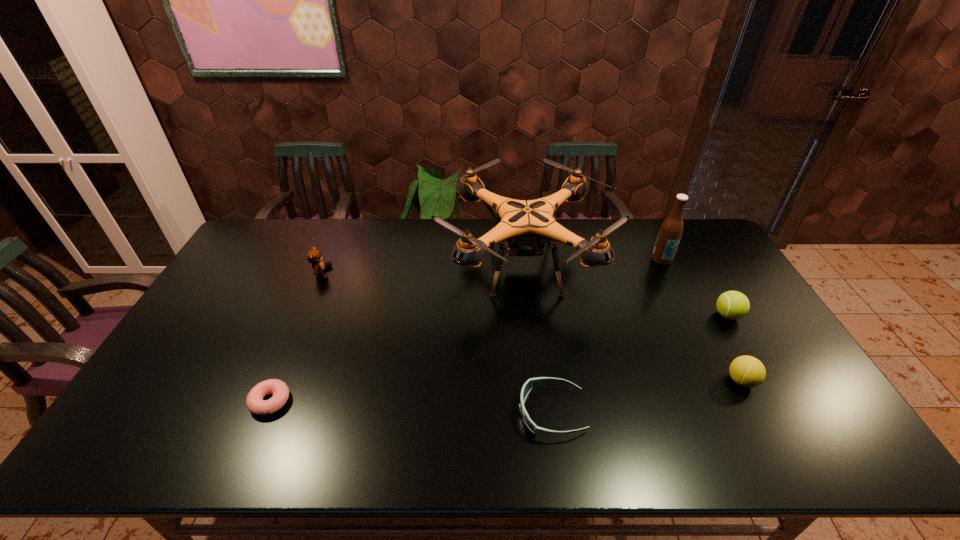
I want to click on free space that satisfies the following two spatial constraints: 1. on the camera mount of the farther tennis ball; 2. on the left side of the drone, so click(529, 315).